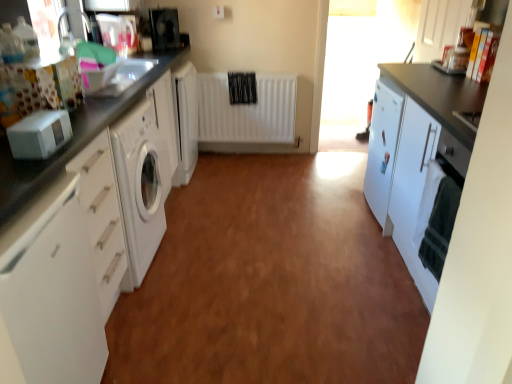
Measure the distance between point (405, 64) and camera.

Point (405, 64) is 3.49 meters away from camera.

What are the coordinates of `white matte microwave at left, the second appliance from the top` in the screenshot? It's located at [39, 134].

The width and height of the screenshot is (512, 384). What do you see at coordinates (360, 62) in the screenshot? I see `transparent glass window screen at upper right` at bounding box center [360, 62].

Find the location of a particular element. This screenshot has height=384, width=512. black glossy microwave at upper left, the 1th appliance positioned from the top is located at coordinates (164, 28).

From the image's perspective, is white matte radiator at center beneath white matte cabinet at right, arranged as the 3th cabinetry when viewed from the left?

No, from the image's perspective, white matte radiator at center is not beneath white matte cabinet at right, arranged as the 3th cabinetry when viewed from the left.

From a real-world perspective, is white matte radiator at center located higher than white matte cabinet at right, the second cabinetry in the right-to-left sequence?

Incorrect, from a real-world perspective, white matte radiator at center is lower than white matte cabinet at right, the second cabinetry in the right-to-left sequence.

Does white matte radiator at center appear on the right side of white matte cabinet at right, the second cabinetry in the right-to-left sequence?

A: Incorrect, white matte radiator at center is not on the right side of white matte cabinet at right, the second cabinetry in the right-to-left sequence.

Find the location of `the 1st cabinetry counting from the right of the white matte radiator at center`. the 1st cabinetry counting from the right of the white matte radiator at center is located at coordinates (418, 159).

Considering the relative sizes of white glossy washing machine at left and white matte cabinet at right, the second cabinetry in the right-to-left sequence, in the image provided, is white glossy washing machine at left smaller than white matte cabinet at right, the second cabinetry in the right-to-left sequence,?

Indeed, white glossy washing machine at left has a smaller size compared to white matte cabinet at right, the second cabinetry in the right-to-left sequence.

Can you confirm if white glossy washing machine at left is taller than white matte cabinet at right, arranged as the 3th cabinetry when viewed from the left?

In fact, white glossy washing machine at left may be shorter than white matte cabinet at right, arranged as the 3th cabinetry when viewed from the left.

Is white glossy washing machine at left located outside white matte cabinet at right, arranged as the 3th cabinetry when viewed from the left?

white glossy washing machine at left is positioned outside white matte cabinet at right, arranged as the 3th cabinetry when viewed from the left.

From a real-world perspective, is white glossy washing machine at left above or below white matte cabinet at right, arranged as the 3th cabinetry when viewed from the left?

white glossy washing machine at left is below white matte cabinet at right, arranged as the 3th cabinetry when viewed from the left.

Does black glossy microwave at upper left, the 1th appliance positioned from the top, have a lesser width compared to white glossy washing machine at left?

Yes, black glossy microwave at upper left, the 1th appliance positioned from the top, is thinner than white glossy washing machine at left.

You are a GUI agent. You are given a task and a screenshot of the screen. Output one action in this format:
    pyautogui.click(x=<x>, y=<y>)
    Task: Click on the plain in front of the black glossy microwave at upper left, the 1th appliance positioned from the top
    This screenshot has height=384, width=512.
    Given the screenshot: What is the action you would take?
    pyautogui.click(x=270, y=283)

Considering the positions of objects black glossy microwave at upper left, which is counted as the 2th appliance, starting from the bottom, and white glossy washing machine at left in the image provided, who is more to the right, black glossy microwave at upper left, which is counted as the 2th appliance, starting from the bottom, or white glossy washing machine at left?

From the viewer's perspective, white glossy washing machine at left appears more on the right side.

From a real-world perspective, is black glossy microwave at upper left, which is the 2th appliance from front to back, positioned above or below white glossy washing machine at left?

black glossy microwave at upper left, which is the 2th appliance from front to back, is situated higher than white glossy washing machine at left in the real world.

From a real-world perspective, who is located lower, white matte cabinet at left, the third cabinetry viewed from the right, or white matte cabinet at right, the second cabinetry in the right-to-left sequence?

In real-world perspective, white matte cabinet at right, the second cabinetry in the right-to-left sequence, is lower.

Considering the points (45, 275) and (415, 269), which point is behind, point (45, 275) or point (415, 269)?

Positioned behind is point (415, 269).

Could you tell me if white matte cabinet at right, the second cabinetry in the right-to-left sequence, is turned towards black glossy microwave at upper left, the 1th appliance positioned from the top?

No, white matte cabinet at right, the second cabinetry in the right-to-left sequence, does not turn towards black glossy microwave at upper left, the 1th appliance positioned from the top.

In the image, is white matte cabinet at right, arranged as the 3th cabinetry when viewed from the left, on the left side or the right side of black glossy microwave at upper left, which is the 2th appliance from front to back?

Clearly, white matte cabinet at right, arranged as the 3th cabinetry when viewed from the left, is on the right of black glossy microwave at upper left, which is the 2th appliance from front to back, in the image.

Can you confirm if white glossy cabinet at left, arranged as the fourth cabinetry when viewed from the right, is wider than white matte cabinet at left, which is the second cabinetry in left-to-right order?

Yes.

Can you confirm if white glossy cabinet at left, arranged as the fourth cabinetry when viewed from the right, is positioned to the right of white matte cabinet at left, which is the second cabinetry in left-to-right order?

In fact, white glossy cabinet at left, arranged as the fourth cabinetry when viewed from the right, is to the left of white matte cabinet at left, which is the second cabinetry in left-to-right order.

Which of these two, white glossy cabinet at left, arranged as the fourth cabinetry when viewed from the right, or white matte cabinet at left, which is the second cabinetry in left-to-right order, is bigger?

white matte cabinet at left, which is the second cabinetry in left-to-right order, is bigger.

How different are the orientations of white glossy cabinet at left, acting as the first cabinetry starting from the left, and white matte cabinet at left, the third cabinetry viewed from the right, in degrees?

They differ by 0.122 degrees in their facing directions.

At what (x,y) coordinates should I click in order to perform the action: click on radiator below the white matte cabinet at left, the third cabinetry viewed from the right (from a real-world perspective). Please return your answer as a coordinate pair (x, y). This screenshot has width=512, height=384. Looking at the image, I should click on (247, 110).

From the image's perspective, relative to white matte radiator at center, is white matte cabinet at left, which is the second cabinetry in left-to-right order, above or below?

white matte cabinet at left, which is the second cabinetry in left-to-right order, is below white matte radiator at center.

Considering the points (17, 282) and (201, 73), which point is behind, point (17, 282) or point (201, 73)?

Point (201, 73)

From the white matte radiator at center, count 1st cabinetry to the right and point to it. Please provide its 2D coordinates.

[(418, 159)]

Locate an element on the screen. The width and height of the screenshot is (512, 384). cabinetry that is the 1st object above the white glossy washing machine at left (from a real-world perspective) is located at coordinates (418, 159).

Which object lies further to the anchor point white glossy cabinet at upper right, the fourth cabinetry viewed from the left, white matte cabinet at left, the third cabinetry viewed from the right, or white glossy cabinet at left, acting as the first cabinetry starting from the left?

white matte cabinet at left, the third cabinetry viewed from the right.

Estimate the real-world distances between objects in this image. Which object is further from white glossy cabinet at upper right, the fourth cabinetry viewed from the left, white glossy washing machine at left or white matte microwave at left, which is counted as the first appliance, starting from the bottom?

Based on the image, white matte microwave at left, which is counted as the first appliance, starting from the bottom, appears to be further to white glossy cabinet at upper right, the fourth cabinetry viewed from the left.

Estimate the real-world distances between objects in this image. Which object is closer to transparent glass window screen at upper right, white glossy cabinet at left, arranged as the fourth cabinetry when viewed from the right, or white matte cabinet at left, which is the second cabinetry in left-to-right order?

Based on the image, white glossy cabinet at left, arranged as the fourth cabinetry when viewed from the right, appears to be nearer to transparent glass window screen at upper right.

Which object lies further to the anchor point white matte microwave at left, acting as the second appliance starting from the back, white matte cabinet at right, arranged as the 3th cabinetry when viewed from the left, or transparent glass window screen at upper right?

transparent glass window screen at upper right lies further to white matte microwave at left, acting as the second appliance starting from the back, than the other object.

When comparing their distances from white matte cabinet at left, which is the second cabinetry in left-to-right order, does white glossy cabinet at left, acting as the first cabinetry starting from the left, or white matte cabinet at right, arranged as the 3th cabinetry when viewed from the left, seem closer?

Based on the image, white glossy cabinet at left, acting as the first cabinetry starting from the left, appears to be nearer to white matte cabinet at left, which is the second cabinetry in left-to-right order.

Which object lies further to the anchor point white matte microwave at left, which is counted as the first appliance, starting from the bottom, white glossy cabinet at left, acting as the first cabinetry starting from the left, or white glossy washing machine at left?

white glossy washing machine at left is positioned further to the anchor white matte microwave at left, which is counted as the first appliance, starting from the bottom.

Looking at the image, which one is located closer to transparent glass window screen at upper right, black glossy microwave at upper left, the 1th appliance positioned from the top, or white matte microwave at left, the second appliance from the top?

Among the two, black glossy microwave at upper left, the 1th appliance positioned from the top, is located nearer to transparent glass window screen at upper right.

Which object lies nearer to the anchor point white glossy cabinet at upper right, the fourth cabinetry viewed from the left, white matte radiator at center or white glossy cabinet at left, acting as the first cabinetry starting from the left?

white matte radiator at center is closer to white glossy cabinet at upper right, the fourth cabinetry viewed from the left.

The height and width of the screenshot is (384, 512). In order to click on appliance between white matte microwave at left, the second appliance from the top, and white matte radiator at center, along the z-axis in this screenshot , I will do `click(164, 28)`.

Locate an element on the screen. The height and width of the screenshot is (384, 512). cabinetry situated between white glossy cabinet at left, acting as the first cabinetry starting from the left, and white glossy washing machine at left from left to right is located at coordinates (50, 294).

In order to click on plain located between white matte cabinet at left, which is the second cabinetry in left-to-right order, and black glossy microwave at upper left, the 1th appliance positioned from the top, in the depth direction in this screenshot , I will do `click(270, 283)`.

You are a GUI agent. You are given a task and a screenshot of the screen. Output one action in this format:
    pyautogui.click(x=<x>, y=<y>)
    Task: Click on the radiator situated between black glossy microwave at upper left, the 1th appliance positioned from the top, and white glossy cabinet at upper right, arranged as the 1th cabinetry when viewed from the right, from left to right
    This screenshot has height=384, width=512.
    Given the screenshot: What is the action you would take?
    pyautogui.click(x=247, y=110)